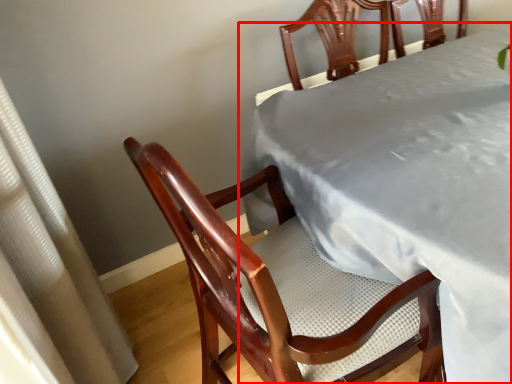
Question: Considering the relative positions of table (annotated by the red box) and curtain in the image provided, where is table (annotated by the red box) located with respect to the staircase?

Choices:
 (A) left
 (B) right

Answer: (B)